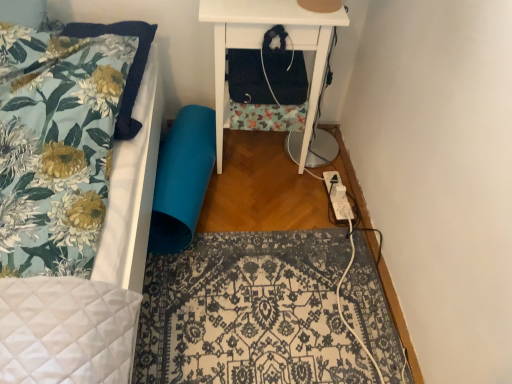
This screenshot has height=384, width=512. I want to click on vacant space that is in between patterned fabric rug at center and teal fabric swivel chair at lower left, so click(x=250, y=208).